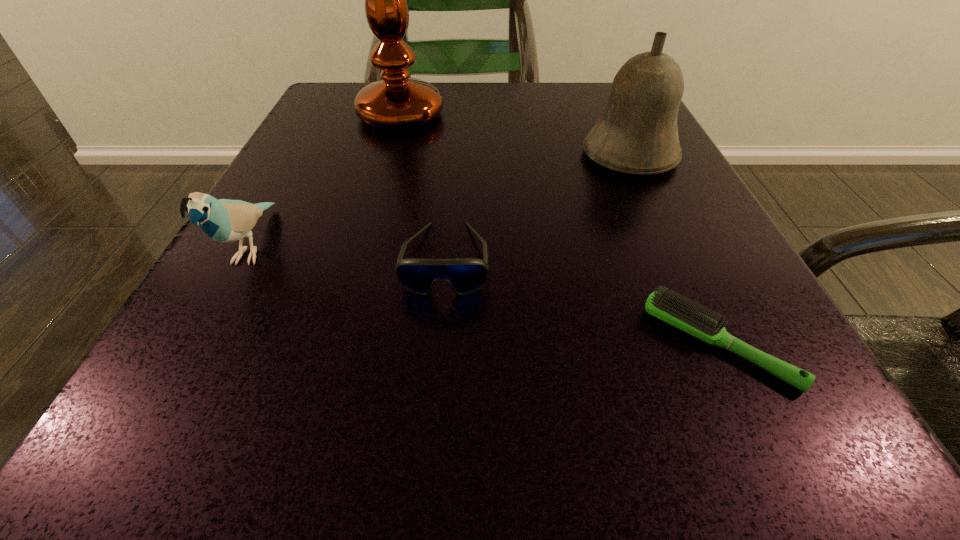
This screenshot has height=540, width=960. I want to click on free region at the left edge, so click(x=372, y=140).

In the image, there is a desktop. Find the location of `vacant space at the right edge`. vacant space at the right edge is located at coordinates (731, 381).

You are a GUI agent. You are given a task and a screenshot of the screen. Output one action in this format:
    pyautogui.click(x=<x>, y=<y>)
    Task: Click on the vacant space at the far left corner of the desktop
    
    Given the screenshot: What is the action you would take?
    pyautogui.click(x=353, y=126)

Where is `vacant area at the far right corner of the desktop`? vacant area at the far right corner of the desktop is located at coordinates (590, 125).

This screenshot has height=540, width=960. What are the coordinates of `vacant space in between the tallest object and the hairbrush` in the screenshot? It's located at (560, 229).

Find the location of `empty space between the sunglasses and the table lamp`. empty space between the sunglasses and the table lamp is located at coordinates (423, 187).

You are a GUI agent. You are given a task and a screenshot of the screen. Output one action in this format:
    pyautogui.click(x=<x>, y=<y>)
    Task: Click on the free space between the table lamp and the second shortest object
    Image resolution: width=960 pixels, height=540 pixels.
    Given the screenshot: What is the action you would take?
    pyautogui.click(x=423, y=187)

Locate an element on the screen. The image size is (960, 540). vacant space that's between the shortest object and the second tallest object is located at coordinates (674, 249).

I want to click on vacant point located between the shortest object and the second shortest object, so click(582, 301).

This screenshot has width=960, height=540. I want to click on free space between the bird and the hairbrush, so click(x=486, y=295).